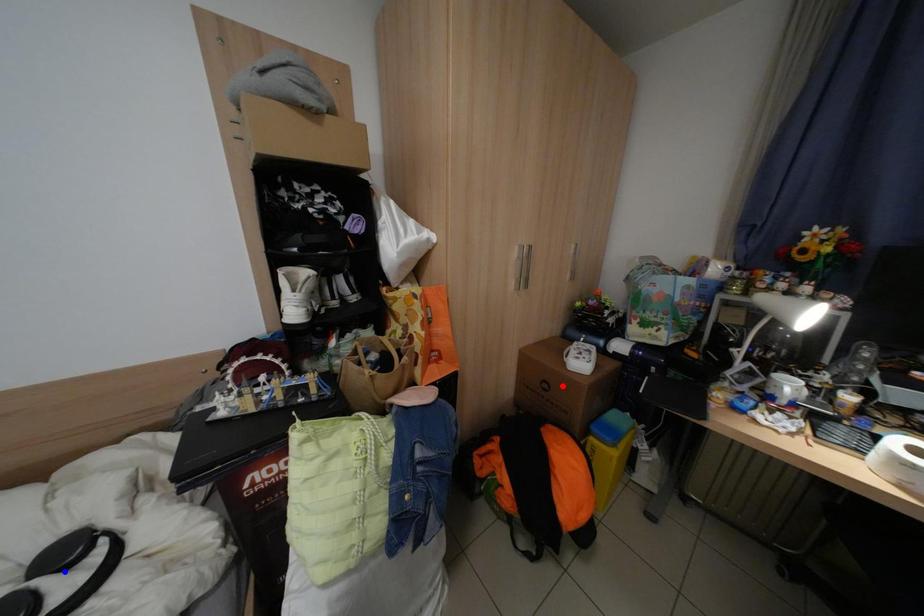
Question: Which of the two points in the image is closer to the camera?

Choices:
 (A) Blue point is closer.
 (B) Red point is closer.

Answer: (A)